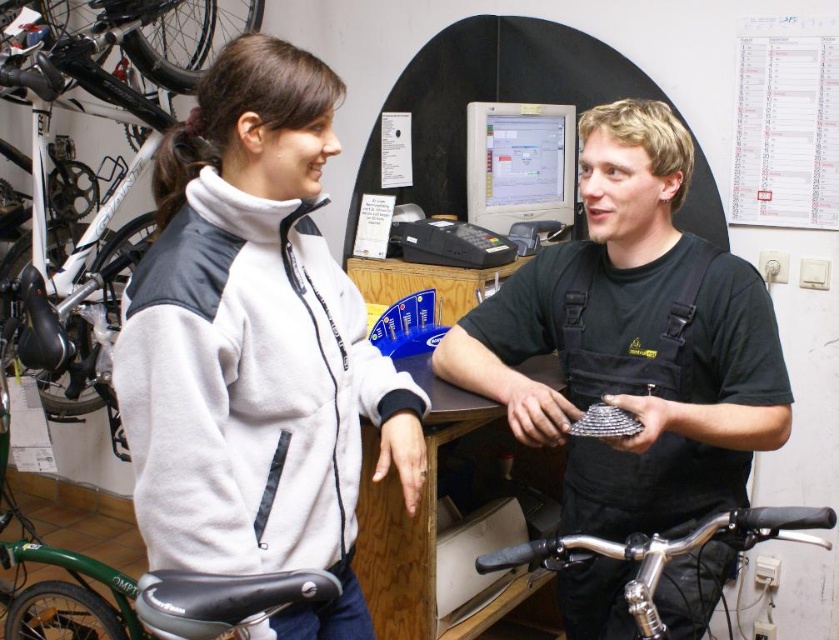
Question: Is white fleece jacket at left to the right of black matte uniform at center from the viewer's perspective?

Choices:
 (A) yes
 (B) no

Answer: (B)

Question: Which is nearer to the white fleece jacket at left?

Choices:
 (A) black matte uniform at center
 (B) polished chrome handlebars at lower center

Answer: (B)

Question: Does white fleece jacket at left appear on the right side of black matte uniform at center?

Choices:
 (A) no
 (B) yes

Answer: (A)

Question: Which point appears closest to the camera in this image?

Choices:
 (A) (504, 353)
 (B) (831, 518)

Answer: (B)

Question: Estimate the real-world distances between objects in this image. Which object is farther from the polished chrome handlebars at lower center?

Choices:
 (A) white fleece jacket at left
 (B) matte gray monitor at center

Answer: (B)

Question: Can you confirm if matte gray monitor at center is bigger than polished chrome handlebars at lower center?

Choices:
 (A) no
 (B) yes

Answer: (A)